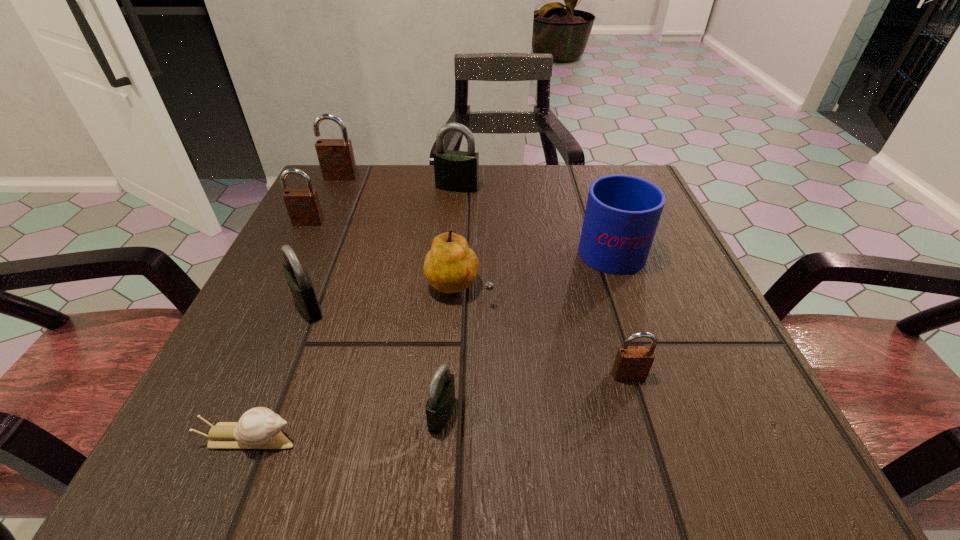
Identify the location of the eighth nearest object. (457, 171).

Locate an element on the screen. The width and height of the screenshot is (960, 540). the farthest black padlock is located at coordinates (457, 171).

Locate an element on the screen. Image resolution: width=960 pixels, height=540 pixels. the farthest brown padlock is located at coordinates (336, 157).

The width and height of the screenshot is (960, 540). I want to click on the farthest padlock, so click(x=336, y=157).

Find the location of `blue mug`. blue mug is located at coordinates (622, 213).

This screenshot has height=540, width=960. In order to click on the second nearest brown padlock in this screenshot , I will do `click(303, 205)`.

The width and height of the screenshot is (960, 540). What are the coordinates of `the second biggest brown padlock` in the screenshot? It's located at (303, 205).

What are the coordinates of `the second farthest black padlock` in the screenshot? It's located at (300, 284).

Find the location of a particular element. This screenshot has height=540, width=960. the fourth farthest padlock is located at coordinates (300, 284).

You are a GUI agent. You are given a task and a screenshot of the screen. Output one action in this format:
    pyautogui.click(x=<x>, y=<y>)
    Task: Click on the pear
    This screenshot has height=540, width=960.
    Given the screenshot: What is the action you would take?
    (450, 266)